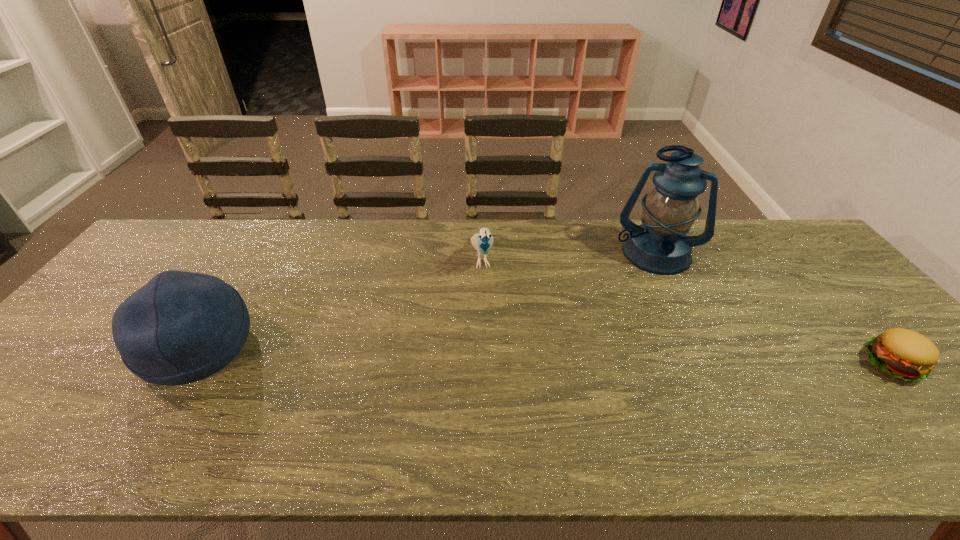
Identify the location of free spot between the lantern and the second shortest object. (567, 256).

Identify the location of empty space between the third tallest object and the third shortest object. The width and height of the screenshot is (960, 540). coord(339,302).

Locate an element on the screen. This screenshot has height=540, width=960. blank region between the third shortest object and the hamburger is located at coordinates (543, 354).

Identify the location of vacant region between the skullcap and the tallest object. This screenshot has width=960, height=540. pyautogui.click(x=424, y=300).

Where is `vacant area that lies between the hamburger and the leftmost object`? Image resolution: width=960 pixels, height=540 pixels. vacant area that lies between the hamburger and the leftmost object is located at coordinates (543, 354).

I want to click on unoccupied area between the bird and the lantern, so click(567, 256).

You are a GUI agent. You are given a task and a screenshot of the screen. Output one action in this format:
    pyautogui.click(x=<x>, y=<y>)
    Task: Click on the blank region between the hamburger and the bird
    The height and width of the screenshot is (540, 960).
    Given the screenshot: What is the action you would take?
    pyautogui.click(x=686, y=310)

The image size is (960, 540). What are the coordinates of `vacant area that lies between the lantern and the shortest object` in the screenshot? It's located at (772, 308).

Locate an element on the screen. object that is the third closest one to the tallest object is located at coordinates (181, 327).

This screenshot has width=960, height=540. Find the location of `object that stands as the second closest to the leftmost object`. object that stands as the second closest to the leftmost object is located at coordinates (659, 245).